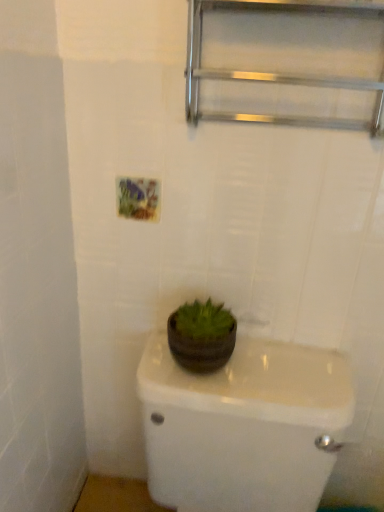
In order to click on vacant space situated above matte brown pot at center (from a real-world perspective) in this screenshot , I will do [x=266, y=380].